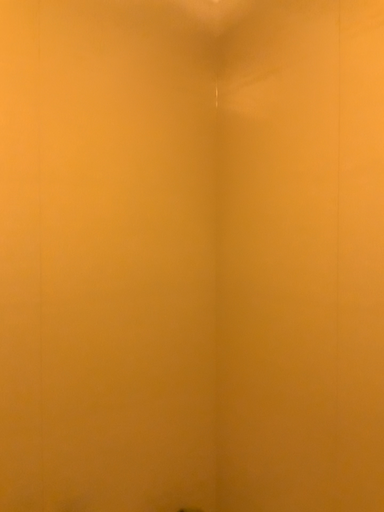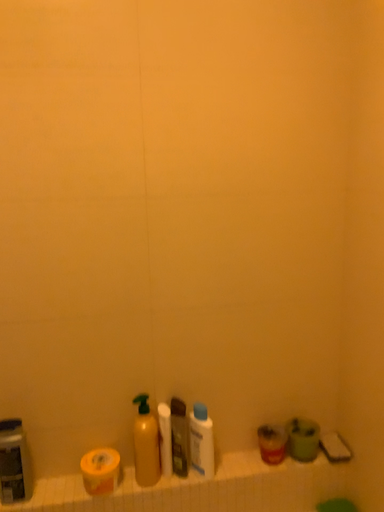
Question: Which way did the camera rotate in the video?

Choices:
 (A) rotated right
 (B) rotated left

Answer: (B)